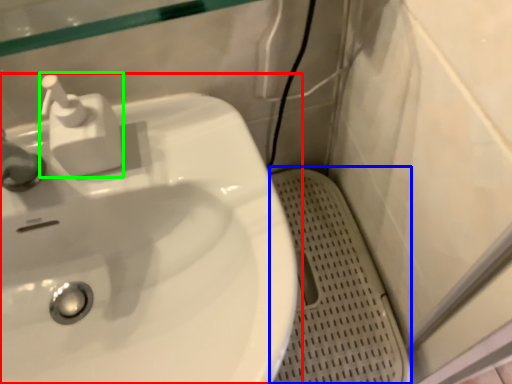
Question: Which is nearer to the sink (highlighted by a red box)? porcelain (highlighted by a blue box) or soap dispenser (highlighted by a green box).

Choices:
 (A) porcelain
 (B) soap dispenser

Answer: (B)